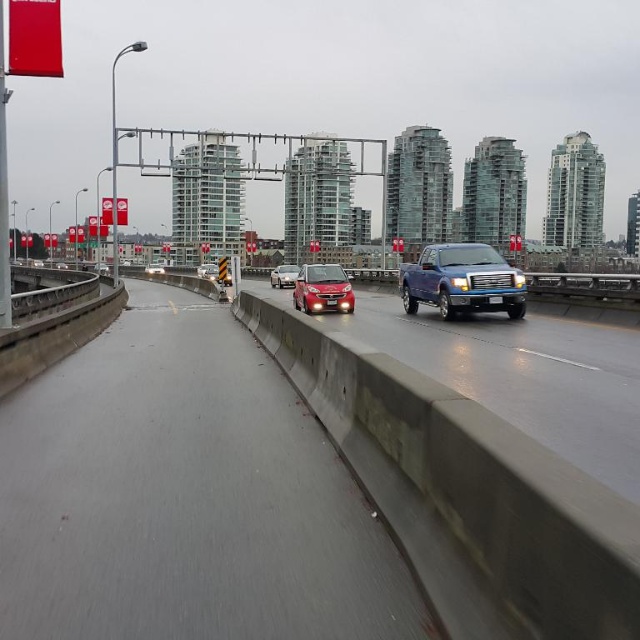
Question: Is shiny silver sedan at center closer to the viewer compared to shiny red sedan at center?

Choices:
 (A) no
 (B) yes

Answer: (B)

Question: Can you confirm if concrete barrier at center is positioned to the right of metallic blue truck at center?

Choices:
 (A) no
 (B) yes

Answer: (A)

Question: Which object appears farthest from the camera in this image?

Choices:
 (A) satin red car at center
 (B) metallic blue truck at center
 (C) concrete barrier at center

Answer: (A)

Question: Which of the following is the closest to the observer?

Choices:
 (A) (476, 243)
 (B) (492, 301)
 (C) (337, 300)

Answer: (B)

Question: Does satin red car at center appear under black plastic license plate at center?

Choices:
 (A) yes
 (B) no

Answer: (B)

Question: Which object appears farthest from the camera in this image?

Choices:
 (A) shiny red sedan at center
 (B) black plastic license plate at center
 (C) concrete barrier at center

Answer: (A)